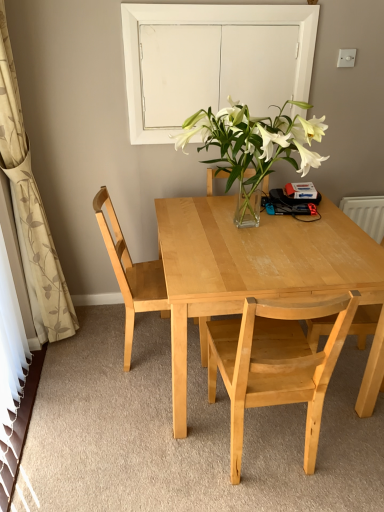
Find the location of `free spot to the left of light wood chair at left, which ranks as the 1th chair in left-to-right order`. free spot to the left of light wood chair at left, which ranks as the 1th chair in left-to-right order is located at coordinates (93, 349).